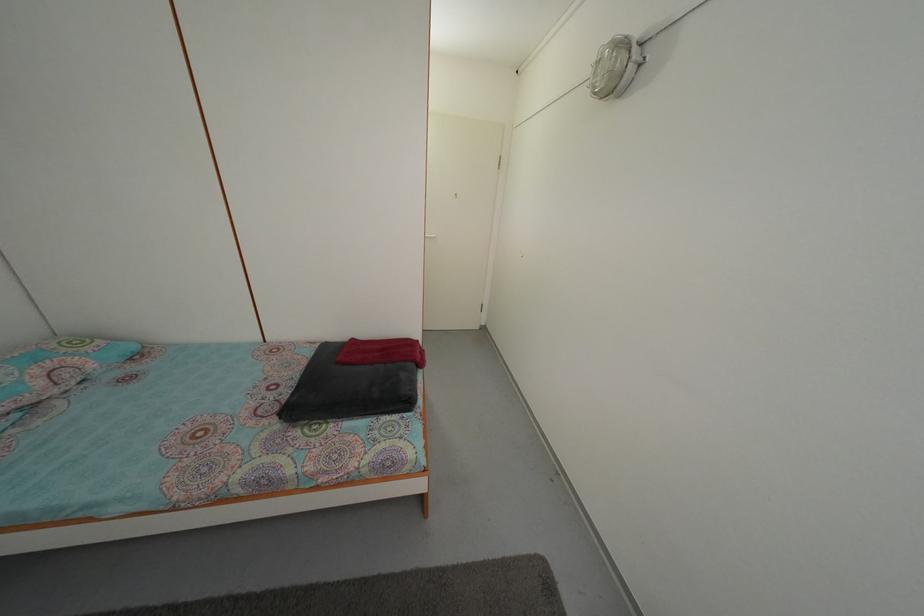
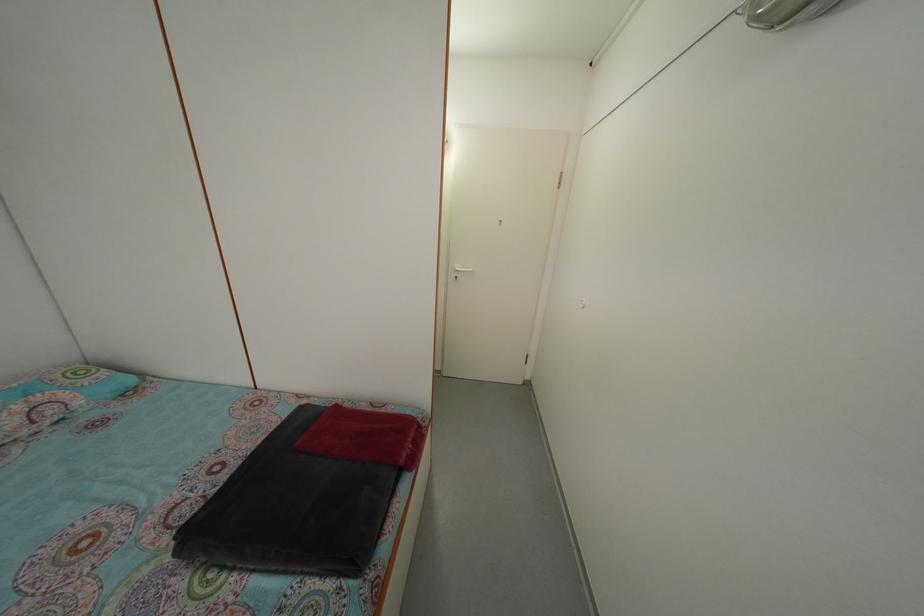
Question: Which direction would the cameraman need to move to produce the second image? Reply with the corresponding letter.

Choices:
 (A) Left
 (B) Right
 (C) Forward
 (D) Backward

Answer: (C)